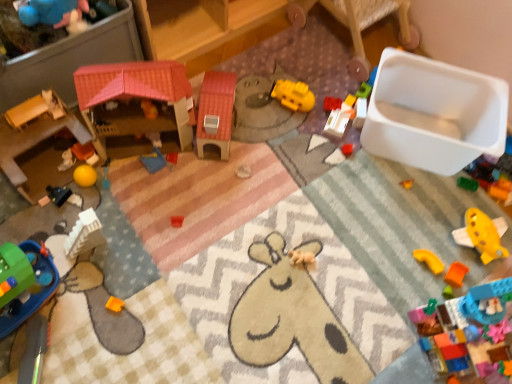
This screenshot has height=384, width=512. In order to click on vacant space that's between orange matte block at lower right, which ranks as the second toy in right-to-left order, and plastic pink house at center, positioned as the 9th toy in right-to-left order in this screenshot , I will do `click(287, 198)`.